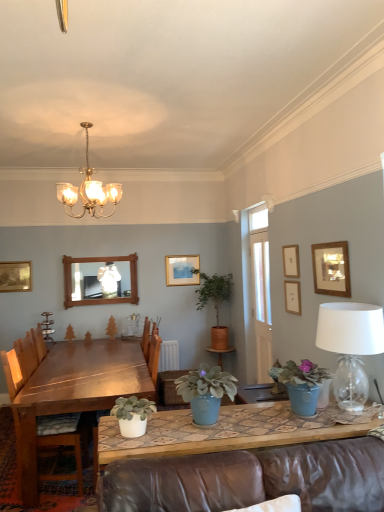
You are a GUI agent. You are given a task and a screenshot of the screen. Output one action in this format:
    pyautogui.click(x=<x>, y=<y>)
    Task: Click on the wooden chair at left
    Image resolution: width=384 pixels, height=512 pixels.
    Given the screenshot: What is the action you would take?
    pyautogui.click(x=63, y=441)

The image size is (384, 512). What do you see at coordinates (215, 303) in the screenshot?
I see `matte brown pot at center, marked as the fourth houseplant in a front-to-back arrangement` at bounding box center [215, 303].

This screenshot has height=512, width=384. I want to click on wooden picture frame at upper center, the second picture frame from the right, so click(x=292, y=297).

This screenshot has height=512, width=384. What do you see at coordinates (182, 270) in the screenshot?
I see `matte gold picture frame at upper center, the 5th picture frame viewed from the front` at bounding box center [182, 270].

Where is `wooden chair at left`? The height and width of the screenshot is (512, 384). wooden chair at left is located at coordinates (63, 441).

Is point (335, 283) less distant than point (130, 389)?

Yes.

Who is bigger, wooden picture frame at upper right, placed as the 5th picture frame when sorted from back to front, or wooden table at left?

wooden table at left is bigger.

Is wooden picture frame at upper right, which is counted as the first picture frame, starting from the front, wider than wooden table at left?

Incorrect, the width of wooden picture frame at upper right, which is counted as the first picture frame, starting from the front, does not surpass that of wooden table at left.

Based on the photo, can you confirm if wooden picture frame at upper right, which is counted as the first picture frame, starting from the front, is shorter than wooden table at left?

Yes, wooden picture frame at upper right, which is counted as the first picture frame, starting from the front, is shorter than wooden table at left.

Who is bigger, clear glass lampshade at right or green matte plant at center, which is the first plant in front-to-back order?

With larger size is clear glass lampshade at right.

Is clear glass lampshade at right oriented towards green matte plant at center, the second plant when ordered from right to left?

No, clear glass lampshade at right is not facing towards green matte plant at center, the second plant when ordered from right to left.

Does clear glass lampshade at right appear on the left side of green matte plant at center, which is the first plant in front-to-back order?

No, clear glass lampshade at right is not to the left of green matte plant at center, which is the first plant in front-to-back order.

Considering the positions of objects matte blue pot at center, which is the second houseplant in front-to-back order, and gold-framed picture at upper left, acting as the fifth picture frame starting from the right, in the image provided, who is in front, matte blue pot at center, which is the second houseplant in front-to-back order, or gold-framed picture at upper left, acting as the fifth picture frame starting from the right,?

matte blue pot at center, which is the second houseplant in front-to-back order.

In terms of height, does matte blue pot at center, which is the third houseplant from back to front, look taller or shorter compared to gold-framed picture at upper left, the first picture frame in the left-to-right sequence?

Considering their sizes, matte blue pot at center, which is the third houseplant from back to front, has less height than gold-framed picture at upper left, the first picture frame in the left-to-right sequence.

Is matte blue pot at center, which is the second houseplant in front-to-back order, aimed at gold-framed picture at upper left, the 4th picture frame when ordered from front to back?

Yes, matte blue pot at center, which is the second houseplant in front-to-back order, is aimed at gold-framed picture at upper left, the 4th picture frame when ordered from front to back.

From the image's perspective, is blue ceramic plant pot at right, which ranks as the 2th houseplant in back-to-front order, located beneath matte brown pot at center, which is the first houseplant in back-to-front order?

Indeed, from the image's perspective, blue ceramic plant pot at right, which ranks as the 2th houseplant in back-to-front order, is shown beneath matte brown pot at center, which is the first houseplant in back-to-front order.

Is blue ceramic plant pot at right, which ranks as the 2th houseplant in back-to-front order, outside of matte brown pot at center, marked as the fourth houseplant in a front-to-back arrangement?

That's correct, blue ceramic plant pot at right, which ranks as the 2th houseplant in back-to-front order, is outside of matte brown pot at center, marked as the fourth houseplant in a front-to-back arrangement.

The width and height of the screenshot is (384, 512). I want to click on houseplant that is above the blue ceramic plant pot at right, the third houseplant viewed from the front (from a real-world perspective), so click(215, 303).

What's the angular difference between wooden picture frame at upper center, the second picture frame from the right, and matte brown pot at center, marked as the fourth houseplant in a front-to-back arrangement,'s facing directions?

The facing directions of wooden picture frame at upper center, the second picture frame from the right, and matte brown pot at center, marked as the fourth houseplant in a front-to-back arrangement, are 89.5 degrees apart.

Which is in front, wooden picture frame at upper center, which is counted as the 3th picture frame, starting from the back, or matte brown pot at center, which is the first houseplant in back-to-front order?

wooden picture frame at upper center, which is counted as the 3th picture frame, starting from the back, is in front.

Does wooden picture frame at upper center, the 3th picture frame in the front-to-back sequence, have a smaller size compared to matte brown pot at center, marked as the fourth houseplant in a front-to-back arrangement?

Indeed, wooden picture frame at upper center, the 3th picture frame in the front-to-back sequence, has a smaller size compared to matte brown pot at center, marked as the fourth houseplant in a front-to-back arrangement.

Which object is positioned more to the right, wooden picture frame at upper center, the 3th picture frame in the front-to-back sequence, or matte brown pot at center, marked as the fourth houseplant in a front-to-back arrangement?

wooden picture frame at upper center, the 3th picture frame in the front-to-back sequence.

Between wooden picture frame at upper center, the third picture frame viewed from the left, and wooden mirror at upper center, which one is positioned in front?

wooden picture frame at upper center, the third picture frame viewed from the left.

Is wooden picture frame at upper center, which appears as the 3th picture frame when viewed from the right, not near wooden mirror at upper center?

That's right, there is a large distance between wooden picture frame at upper center, which appears as the 3th picture frame when viewed from the right, and wooden mirror at upper center.

Is wooden picture frame at upper center, positioned as the second picture frame in front-to-back order, to the left of wooden mirror at upper center from the viewer's perspective?

In fact, wooden picture frame at upper center, positioned as the second picture frame in front-to-back order, is to the right of wooden mirror at upper center.

Does point (293, 275) lie behind point (70, 276)?

No, (293, 275) is in front of (70, 276).

The height and width of the screenshot is (512, 384). In order to click on the 1st picture frame directly above the wooden table at left (from a real-world perspective) in this screenshot , I will do `click(292, 297)`.

Is point (147, 388) positioned behind point (298, 295)?

No, (147, 388) is closer to viewer.

Does wooden table at left lie behind wooden picture frame at upper center, which is counted as the 3th picture frame, starting from the back?

That is False.

Which of these two, wooden table at left or wooden picture frame at upper center, which is counted as the fourth picture frame, starting from the left, is smaller?

wooden picture frame at upper center, which is counted as the fourth picture frame, starting from the left, is smaller.

Identify the location of table located underneath the wooden picture frame at upper right, the first picture frame when ordered from right to left (from a real-world perspective). The width and height of the screenshot is (384, 512). (66, 392).

In the image, there is a green matte plant at center, the second plant when ordered from right to left. In order to click on table lamp above it (from the image's perspective) in this screenshot , I will do click(x=350, y=346).

Considering their positions, is blue ceramic plant pot at right, which ranks as the 2th houseplant in back-to-front order, positioned further to wooden mirror at upper center than matte blue pot at center, which is the second houseplant in front-to-back order?

The object further to wooden mirror at upper center is blue ceramic plant pot at right, which ranks as the 2th houseplant in back-to-front order.

Based on their spatial positions, is matte brown pot at center, marked as the fourth houseplant in a front-to-back arrangement, or green matte plant at center, the second plant from the left, further from gold-framed picture at upper left, which ranks as the 2th picture frame in back-to-front order?

matte brown pot at center, marked as the fourth houseplant in a front-to-back arrangement.

From the image, which object appears to be farther from green matte plant at center, the 2th plant positioned from the back, wooden mirror at upper center or wooden table at left?

Based on the image, wooden table at left appears to be further to green matte plant at center, the 2th plant positioned from the back.

Considering their positions, is wooden mirror at upper center positioned further to wooden picture frame at upper right, placed as the 5th picture frame when sorted from back to front, than white matte pot at lower center, marked as the 1th houseplant in a front-to-back arrangement?

wooden mirror at upper center is positioned further to the anchor wooden picture frame at upper right, placed as the 5th picture frame when sorted from back to front.

In the scene shown: Based on their spatial positions, is matte blue pot at center, which is the third houseplant from back to front, or gold-framed picture at upper left, acting as the fifth picture frame starting from the right, further from white wooden door at right?

gold-framed picture at upper left, acting as the fifth picture frame starting from the right, is positioned further to the anchor white wooden door at right.

Based on their spatial positions, is green matte plant at center, the 1th plant viewed from the left, or matte brown pot at center, marked as the fourth houseplant in a front-to-back arrangement, further from matte gold picture frame at upper center, the 5th picture frame viewed from the front?

Based on the image, green matte plant at center, the 1th plant viewed from the left, appears to be further to matte gold picture frame at upper center, the 5th picture frame viewed from the front.

Looking at the image, which one is located closer to wooden chair at left, wooden picture frame at upper center, which appears as the 3th picture frame when viewed from the right, or white wooden door at right?

wooden picture frame at upper center, which appears as the 3th picture frame when viewed from the right, lies closer to wooden chair at left than the other object.

Based on their spatial positions, is wooden picture frame at upper center, positioned as the second picture frame in front-to-back order, or gold metallic chandelier at upper center closer to wooden picture frame at upper center, which is counted as the 3th picture frame, starting from the back?

wooden picture frame at upper center, positioned as the second picture frame in front-to-back order.

The width and height of the screenshot is (384, 512). In order to click on chandelier between gold-framed picture at upper left, acting as the fifth picture frame starting from the right, and matte brown pot at center, which is the first houseplant in back-to-front order in this screenshot , I will do `click(89, 190)`.

Where is `chandelier located between blue ceramic plant pot at right, the third houseplant viewed from the front, and wooden mirror at upper center in the depth direction`? This screenshot has height=512, width=384. chandelier located between blue ceramic plant pot at right, the third houseplant viewed from the front, and wooden mirror at upper center in the depth direction is located at coordinates (89, 190).

The height and width of the screenshot is (512, 384). I want to click on chandelier between white matte pot at lower center, marked as the 1th houseplant in a front-to-back arrangement, and green matte plant at center, which is the first plant in front-to-back order, from front to back, so click(89, 190).

Where is `table between gold-framed picture at upper left, acting as the fifth picture frame starting from the right, and wooden picture frame at upper right, marked as the fifth picture frame in a left-to-right arrangement, from left to right`? Image resolution: width=384 pixels, height=512 pixels. table between gold-framed picture at upper left, acting as the fifth picture frame starting from the right, and wooden picture frame at upper right, marked as the fifth picture frame in a left-to-right arrangement, from left to right is located at coordinates (66, 392).